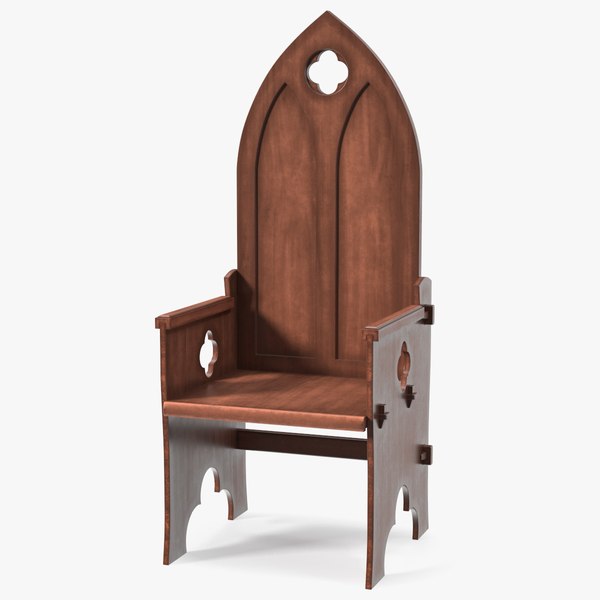
Where is `dark wooden arm rest`? The image size is (600, 600). dark wooden arm rest is located at coordinates (398, 441), (196, 432), (187, 310), (391, 334).